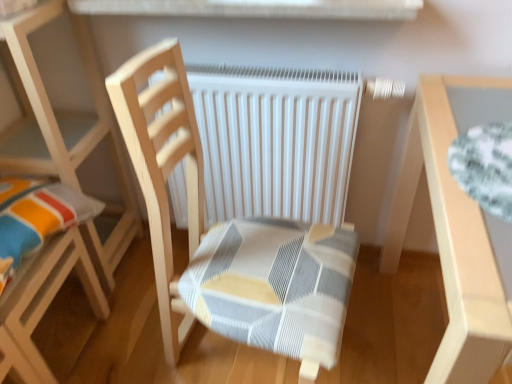
Question: Should I look upward or downward to see wooden chair with striped cushion at center, which ranks as the first chair in right-to-left order?

Choices:
 (A) down
 (B) up

Answer: (A)

Question: Can you confirm if wooden chair at left, the first chair viewed from the left, is thinner than wooden chair with striped cushion at center, which ranks as the first chair in right-to-left order?

Choices:
 (A) yes
 (B) no

Answer: (A)

Question: From the image's perspective, does wooden chair at left, the first chair viewed from the left, appear higher than wooden chair with striped cushion at center, which ranks as the first chair in right-to-left order?

Choices:
 (A) yes
 (B) no

Answer: (A)

Question: Is wooden chair at left, the first chair viewed from the left, not within wooden chair with striped cushion at center, which ranks as the first chair in right-to-left order?

Choices:
 (A) yes
 (B) no

Answer: (A)

Question: Can you confirm if wooden chair at left, the first chair viewed from the left, is wider than wooden chair with striped cushion at center, which is counted as the second chair, starting from the left?

Choices:
 (A) no
 (B) yes

Answer: (A)

Question: Can you confirm if wooden chair at left, the 2th chair in the right-to-left sequence, is taller than wooden chair with striped cushion at center, which is counted as the second chair, starting from the left?

Choices:
 (A) yes
 (B) no

Answer: (A)

Question: Is the position of wooden chair at left, the 2th chair in the right-to-left sequence, more distant than that of wooden chair with striped cushion at center, which is counted as the second chair, starting from the left?

Choices:
 (A) yes
 (B) no

Answer: (A)

Question: Considering the relative positions of light wood table at right and wooden chair at left, the first chair viewed from the left, in the image provided, is light wood table at right behind wooden chair at left, the first chair viewed from the left,?

Choices:
 (A) no
 (B) yes

Answer: (A)

Question: From a real-world perspective, is light wood table at right under wooden chair at left, the 2th chair in the right-to-left sequence?

Choices:
 (A) no
 (B) yes

Answer: (B)

Question: Does light wood table at right turn towards wooden chair at left, the 2th chair in the right-to-left sequence?

Choices:
 (A) no
 (B) yes

Answer: (A)

Question: Is light wood table at right surrounding wooden chair at left, the 2th chair in the right-to-left sequence?

Choices:
 (A) no
 (B) yes

Answer: (A)

Question: Does light wood table at right have a lesser height compared to wooden chair at left, the first chair viewed from the left?

Choices:
 (A) yes
 (B) no

Answer: (A)

Question: Is light wood table at right thinner than wooden chair at left, the first chair viewed from the left?

Choices:
 (A) yes
 (B) no

Answer: (B)

Question: Are wooden chair at left, the first chair viewed from the left, and light wood table at right far apart?

Choices:
 (A) no
 (B) yes

Answer: (A)